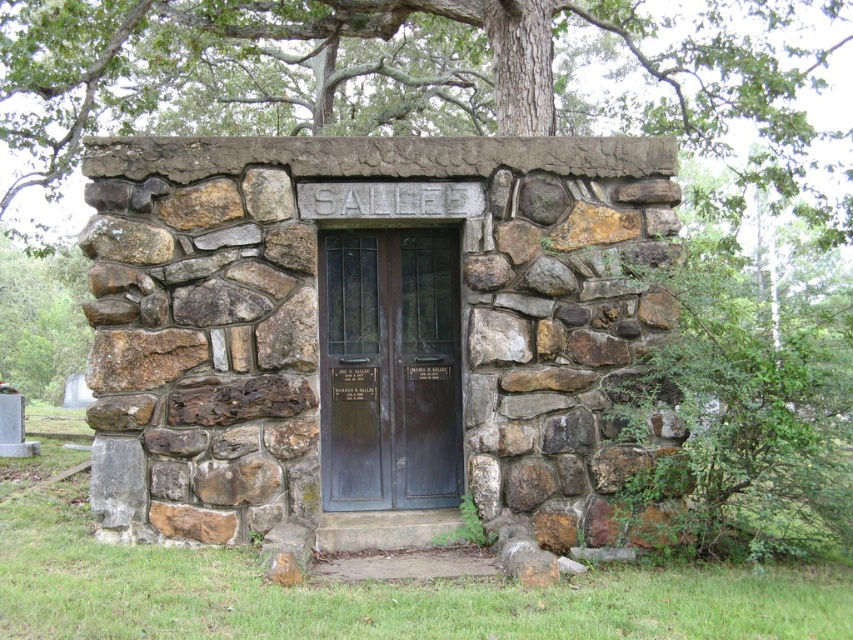
Does point (55, 109) lie in front of point (39, 352)?

Yes, point (55, 109) is in front of point (39, 352).

Is green leafy tree at upper center thinner than green leafy tree at left?

In fact, green leafy tree at upper center might be wider than green leafy tree at left.

Who is more distant from viewer, (814, 166) or (15, 346)?

The point (15, 346) is behind.

The height and width of the screenshot is (640, 853). Find the location of `green leafy tree at upper center`. green leafy tree at upper center is located at coordinates coord(431,77).

How much distance is there between brown stone door at center and green leafy tree at upper center?

20.68 feet

Can you confirm if brown stone door at center is bigger than green leafy tree at upper center?

Actually, brown stone door at center might be smaller than green leafy tree at upper center.

Between point (608, 282) and point (799, 125), which one is positioned behind?

The point (799, 125) is behind.

Identify the location of brown stone door at center. This screenshot has height=640, width=853. (372, 326).

Is the position of brown stone door at center more distant than that of dark brown wood door at center?

No, brown stone door at center is closer to the viewer.

Between point (289, 541) and point (338, 260), which one is positioned behind?

Point (338, 260)

The height and width of the screenshot is (640, 853). What do you see at coordinates (372, 326) in the screenshot? I see `brown stone door at center` at bounding box center [372, 326].

Locate an element on the screen. This screenshot has height=640, width=853. brown stone door at center is located at coordinates (372, 326).